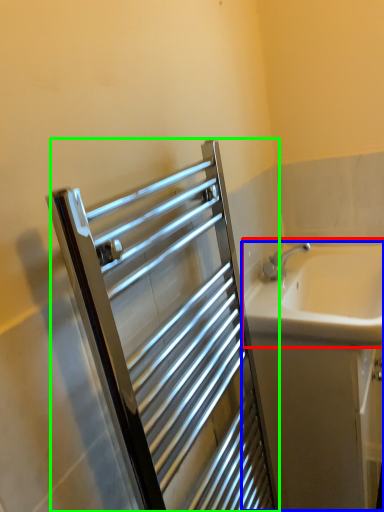
Question: Which object is positioned closest to sink (highlighted by a red box)? Select from bath (highlighted by a blue box) and screen door (highlighted by a green box).

Choices:
 (A) bath
 (B) screen door

Answer: (A)